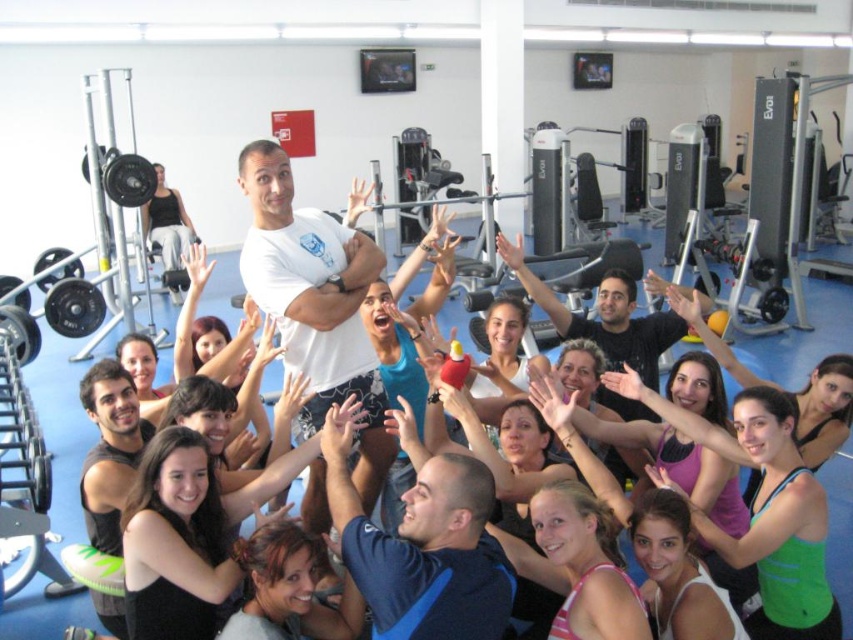
Based on the gym scene described, where is the blue fabric shirt at center located in terms of its 2D coordinates?

The blue fabric shirt at center is located at the 2D coordinates point (x=422, y=547).